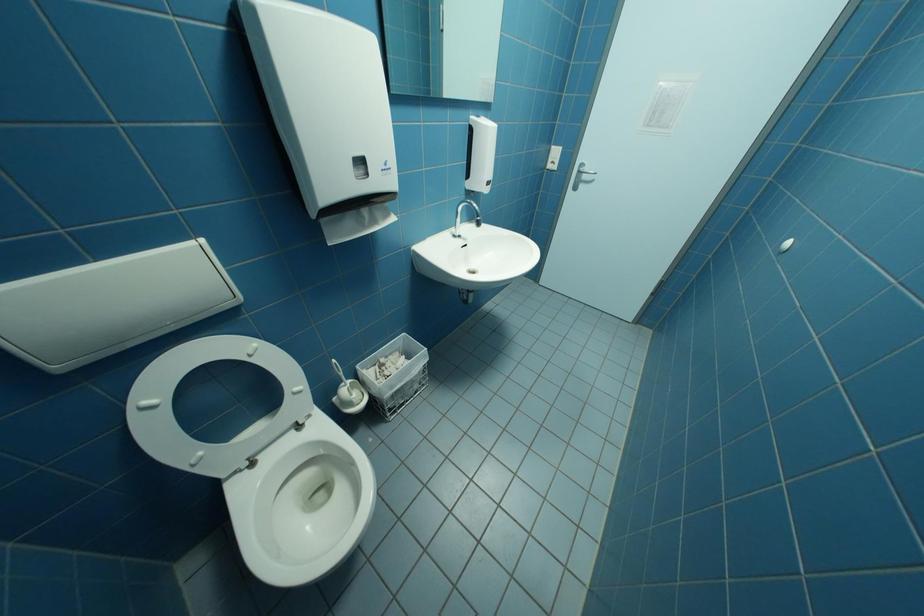
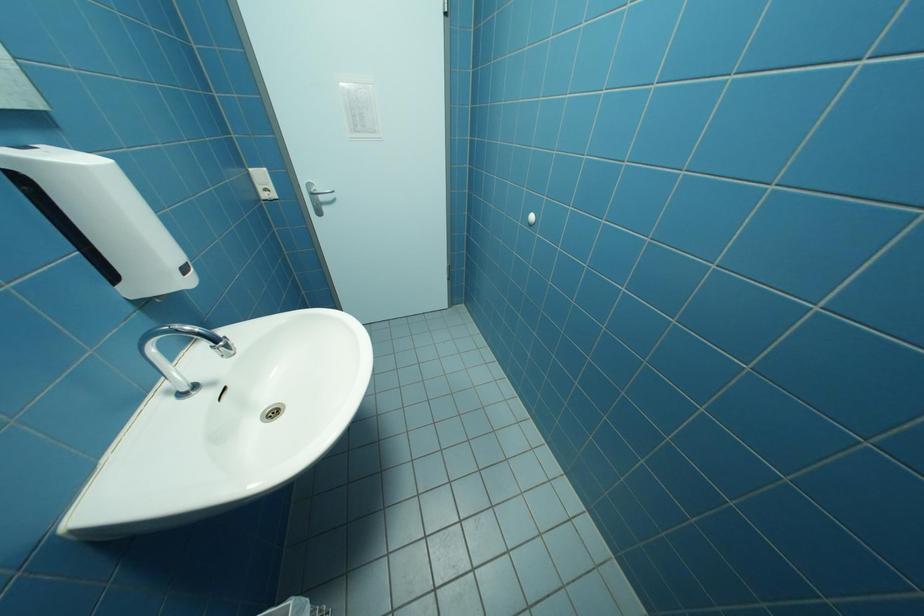
Question: The first image is from the beginning of the video and the second image is from the end. How did the camera likely rotate when shooting the video?

Choices:
 (A) Left
 (B) Right
 (C) Up
 (D) Down

Answer: (B)